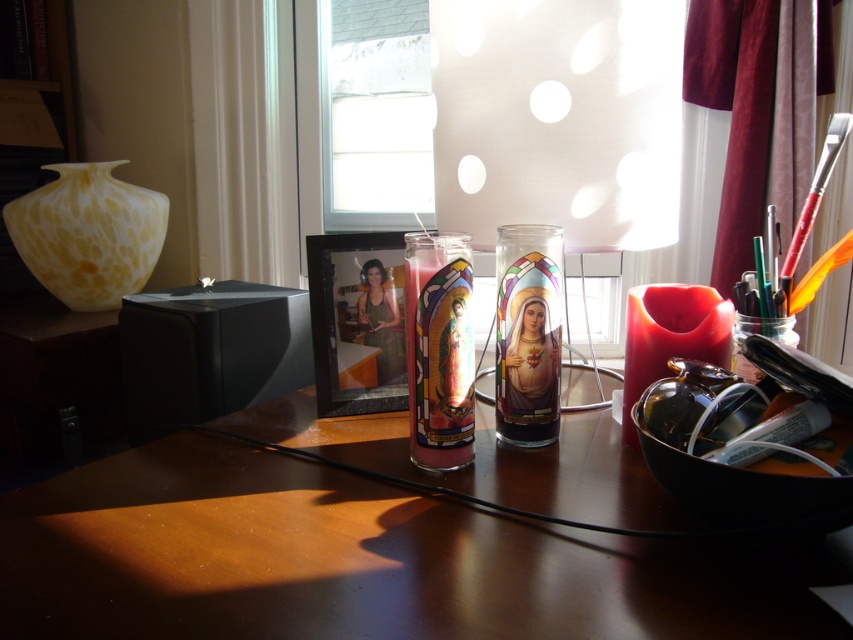
You are organizing items on the brown wooden table at center and need to place the stained glass candle at center. Considering their sizes, will the candle fit on the table without exceeding its height?

The brown wooden table at center is not as tall as the stained glass candle at center, meaning the candle is taller. Therefore, the candle may not fit properly on the table if the table is shorter than the candle.

What is the exact 2D coordinate of the matte white lampshade at center?

The exact 2D coordinate of the matte white lampshade at center is point (558, 118).